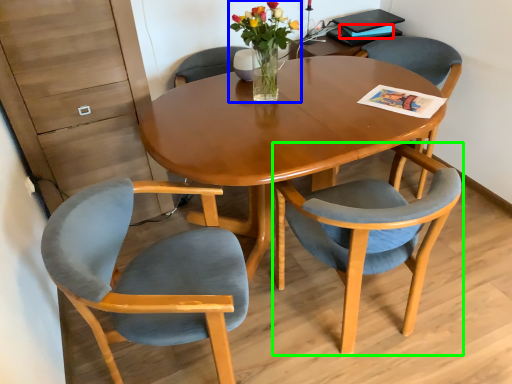
Question: Based on their relative distances, which object is farther from magazine (highlighted by a red box)? Choose from floral arrangement (highlighted by a blue box) and chair (highlighted by a green box).

Choices:
 (A) floral arrangement
 (B) chair

Answer: (B)